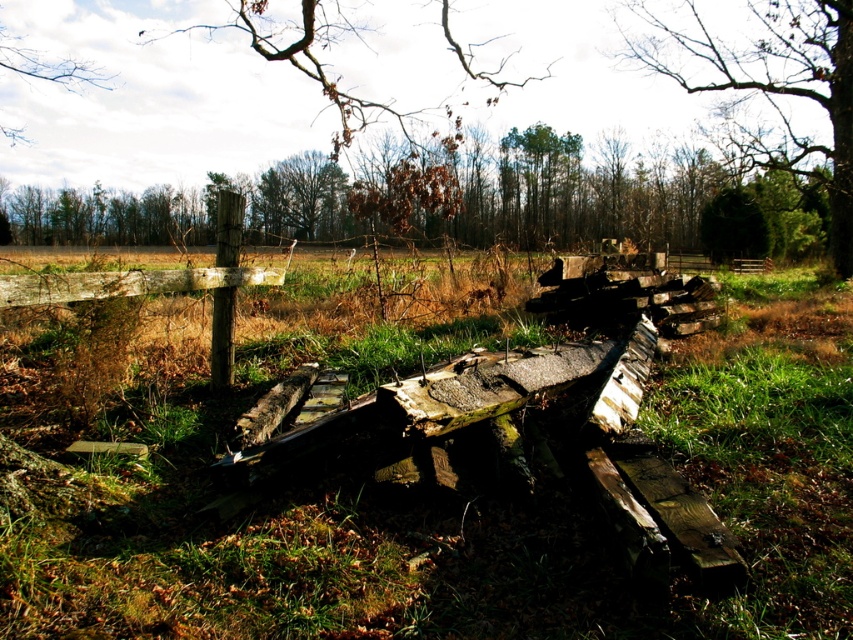
Question: Can you confirm if brown leafy tree at upper center is smaller than brown wood tree at upper left?

Choices:
 (A) no
 (B) yes

Answer: (A)

Question: Which point is farther to the camera?

Choices:
 (A) brown wood tree at upper left
 (B) bare wood tree at upper center
 (C) green grass at center

Answer: (A)

Question: Which point appears farthest from the camera in this image?

Choices:
 (A) (410, 589)
 (B) (15, 45)
 (C) (791, 42)
 (D) (370, 118)

Answer: (D)

Question: Where is green grass at center located in relation to brown leafy tree at upper center in the image?

Choices:
 (A) left
 (B) right

Answer: (B)

Question: Can you confirm if green grass at center is bigger than brown wood tree at upper left?

Choices:
 (A) no
 (B) yes

Answer: (B)

Question: Considering the real-world distances, which object is closest to the brown leafy tree at upper center?

Choices:
 (A) bare wood tree at upper center
 (B) brown wood tree at upper left

Answer: (A)